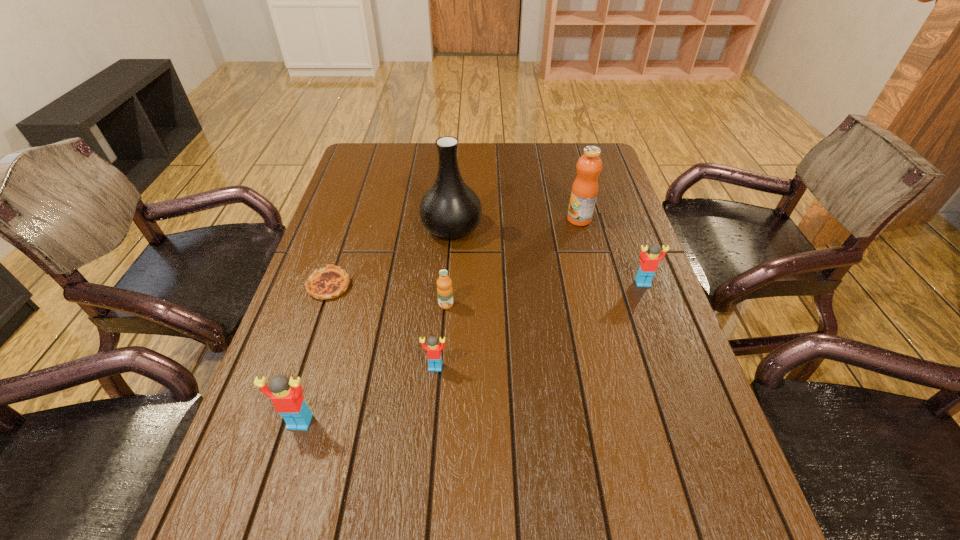
Locate which Lego ranks in proximity to the farthest Lego. Please provide its 2D coordinates. Your answer should be formatted as a tuple, i.e. [(x, y)], where the tuple contains the x and y coordinates of a point satisfying the conditions above.

[(433, 348)]

Locate which Lego ranks third in proximity to the orange juice. Please provide its 2D coordinates. Your answer should be formatted as a tuple, i.e. [(x, y)], where the tuple contains the x and y coordinates of a point satisfying the conditions above.

[(649, 262)]

Find the location of a particular element. The height and width of the screenshot is (540, 960). free space that satisfies the following two spatial constraints: 1. on the back side of the quiche; 2. on the right side of the tallest object is located at coordinates (348, 228).